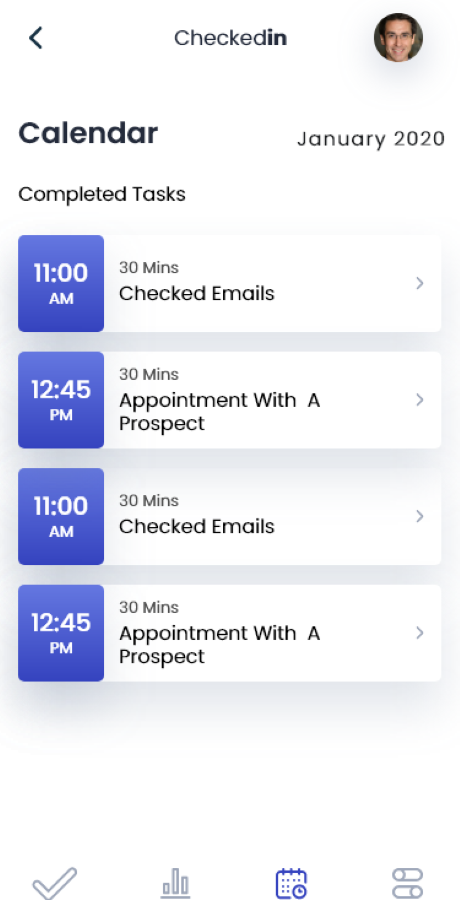
Locate an element on the screen. The width and height of the screenshot is (460, 900). toggle switches is located at coordinates (409, 870).